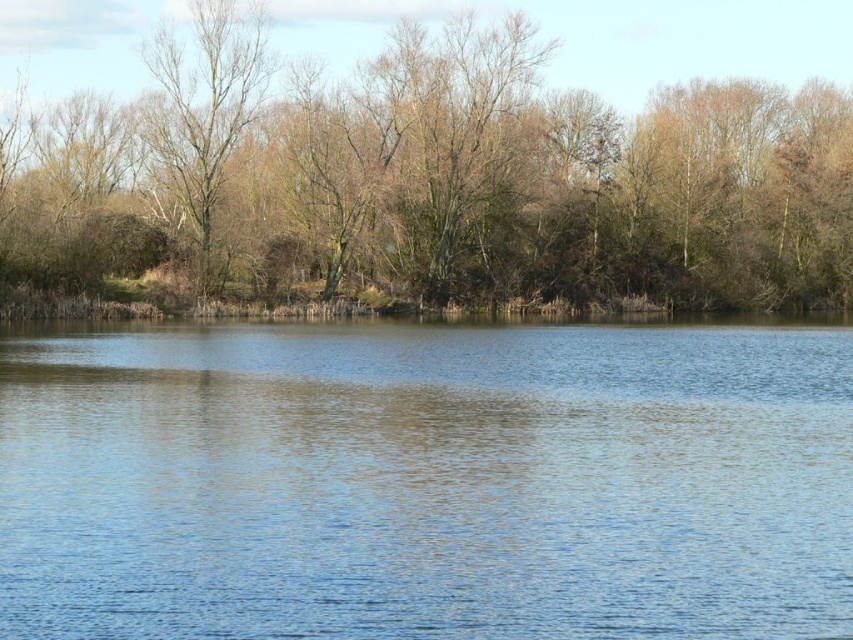
You are standing at the edge of the water in this natural landscape. You see the brown leafless trees at upper center and the bare branches at left. Which of these two objects is positioned to the right side of the other?

The brown leafless trees at upper center is to the right of bare branches at left.

You are standing at the edge of the water in the serene landscape scene. You notice two points marked in the image. The first is at coordinate point (16, 516) and the second is at point (167, 115). Which of these two points is nearer to your current position?

Point (16, 516) is closer to the viewer than point (167, 115), so the first point is nearer to your current position.

You are standing on the shore of the lake and see the blue water at center and the brown leafless trees at upper center. Which object is closer to your right side?

The blue water at center is closer to your right side because it is positioned to the right of the brown leafless trees at upper center.